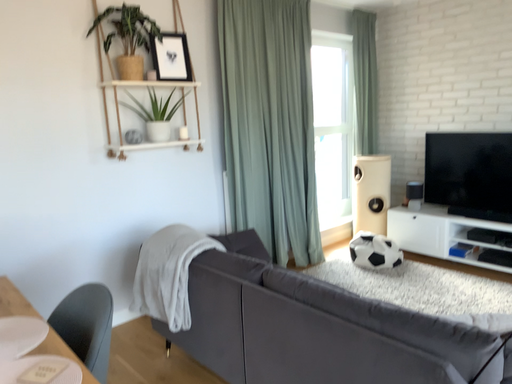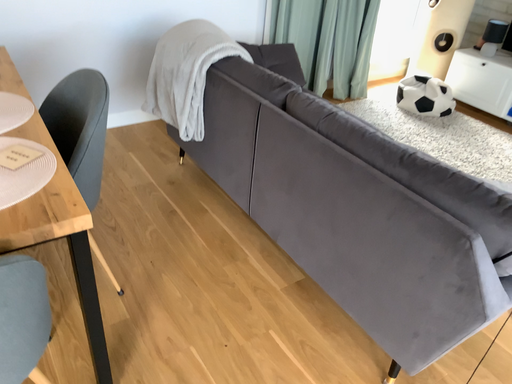
Question: How did the camera likely rotate when shooting the video?

Choices:
 (A) rotated upward
 (B) rotated downward

Answer: (B)